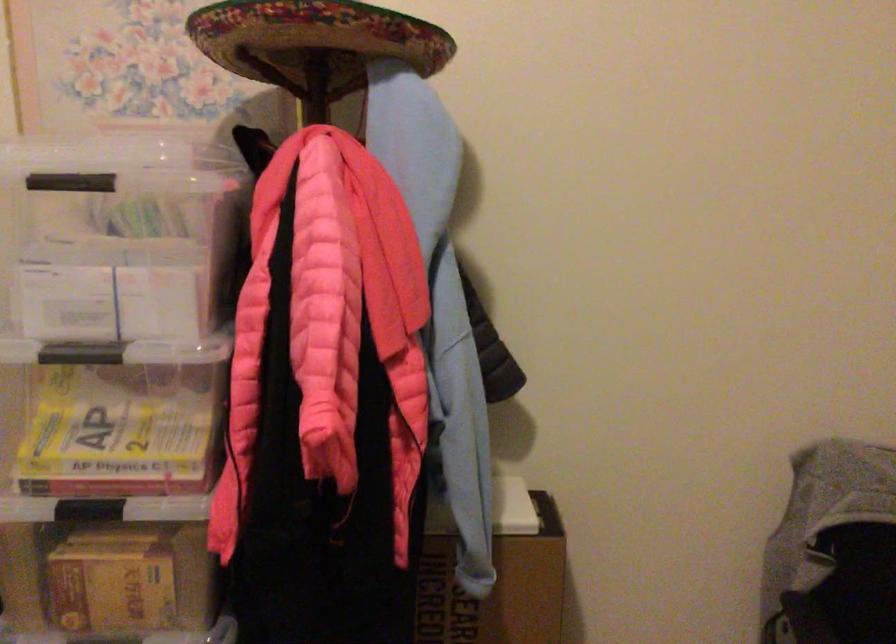
Where would you pull the black bin handle? Please return your answer as a coordinate pair (x, y).

(833, 549)